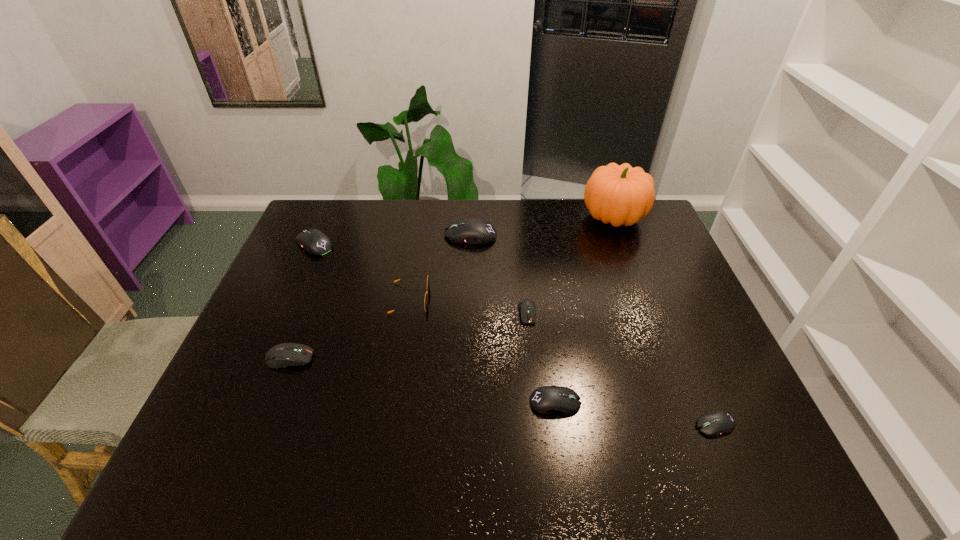
Identify the location of the smaller dark computer equipment. click(x=526, y=307).

In order to click on the farther dark computer equipment in this screenshot , I will do `click(526, 307)`.

This screenshot has width=960, height=540. In order to click on the rightmost black computer equipment in this screenshot , I will do `click(715, 423)`.

The image size is (960, 540). I want to click on the rightmost computer equipment, so click(715, 423).

Find the location of `free location located 0.080m on the left of the orange pumpkin`. free location located 0.080m on the left of the orange pumpkin is located at coordinates (559, 218).

Identify the location of free location located on the left of the seventh shortest object. Image resolution: width=960 pixels, height=540 pixels. (382, 235).

At what (x,y) coordinates should I click in order to perform the action: click on free space located 0.140m on the back of the third smallest black computer equipment. Please return your answer as a coordinate pair (x, y). Looking at the image, I should click on (329, 210).

Find the location of a particular element. Image resolution: width=960 pixels, height=540 pixels. free location located on the front-facing side of the black sunglasses is located at coordinates (449, 299).

At what (x,y) coordinates should I click in order to perform the action: click on vacant space located on the button of the left dark computer equipment. Please return your answer as a coordinate pair (x, y). The height and width of the screenshot is (540, 960). Looking at the image, I should click on (422, 358).

This screenshot has height=540, width=960. Identify the location of free space located on the right of the third biggest black computer equipment. point(686,402).